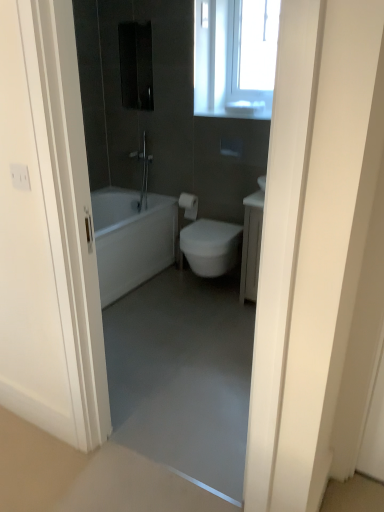
I want to click on vacant space positioned to the left of white glossy door at upper center, so [x=206, y=468].